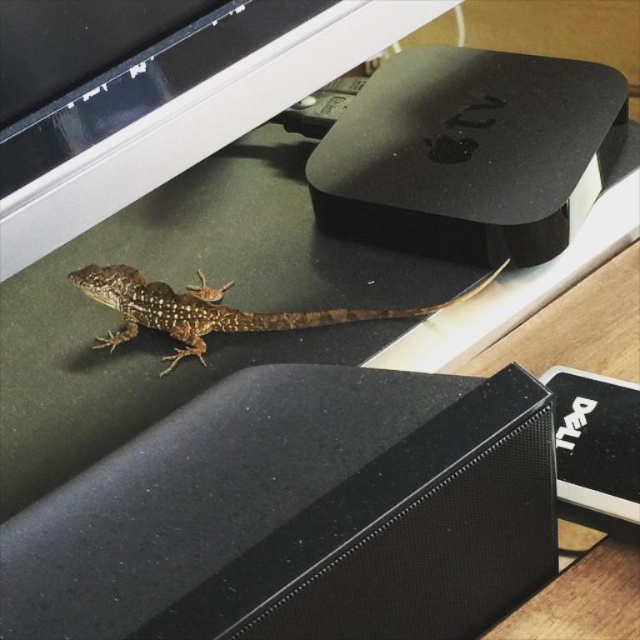
Which is behind, point (252, 602) or point (202, 332)?

Positioned behind is point (202, 332).

Measure the distance between point (246, 428) and camera.

36.36 inches

Image resolution: width=640 pixels, height=640 pixels. Describe the element at coordinates (300, 515) in the screenshot. I see `black matte speaker at lower center` at that location.

What are the coordinates of `black matte speaker at lower center` in the screenshot? It's located at (300, 515).